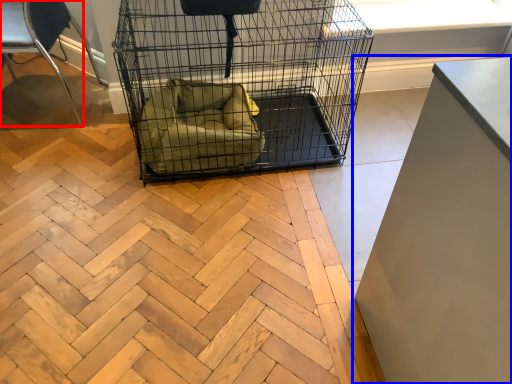
Question: Which of the following is the closest to the observer, chair (highlighted by a red box) or furniture (highlighted by a blue box)?

Choices:
 (A) chair
 (B) furniture

Answer: (B)